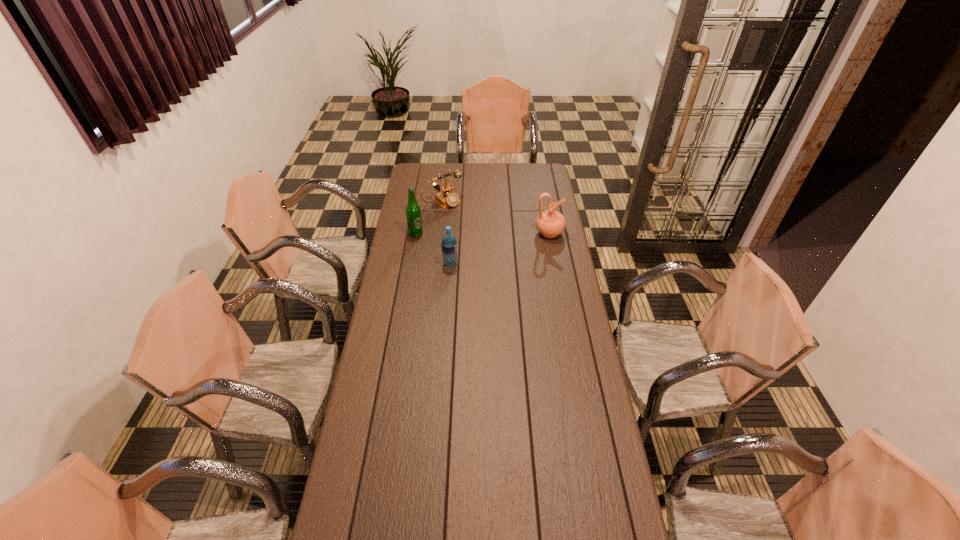
Where is `vacant space located on the label of the beer bottle`? vacant space located on the label of the beer bottle is located at coordinates (483, 245).

The height and width of the screenshot is (540, 960). I want to click on free point located on the label of the beer bottle, so click(x=453, y=240).

This screenshot has width=960, height=540. What are the coordinates of `telephone that is at the left edge` in the screenshot? It's located at (447, 197).

Where is `beer bottle at the left edge`? The height and width of the screenshot is (540, 960). beer bottle at the left edge is located at coordinates click(x=413, y=211).

Locate an element on the screen. This screenshot has height=540, width=960. object that is at the right edge is located at coordinates (550, 223).

This screenshot has height=540, width=960. In order to click on vacant space at the far edge in this screenshot , I will do `click(444, 170)`.

In order to click on free space at the left edge of the desktop in this screenshot , I will do `click(402, 210)`.

This screenshot has width=960, height=540. In the image, there is a desktop. Find the location of `vacant space at the right edge`. vacant space at the right edge is located at coordinates (533, 199).

Image resolution: width=960 pixels, height=540 pixels. Identify the location of free region at the far left corner of the desktop. (420, 165).

Where is `vacant space at the near left corner`? This screenshot has width=960, height=540. vacant space at the near left corner is located at coordinates (348, 503).